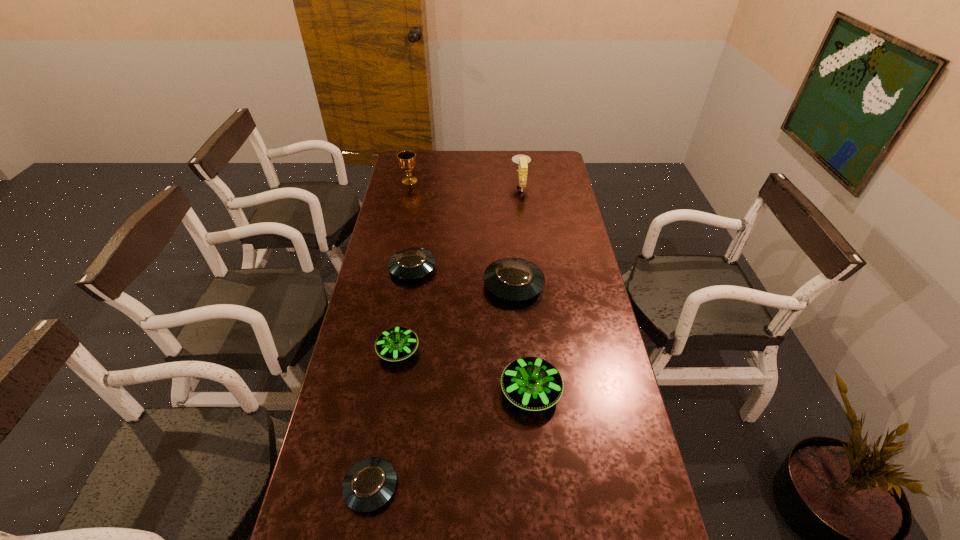
The image size is (960, 540). Identify the location of free spot located on the front-facing side of the yellow sponge. click(444, 186).

Where is `vacant area situated 0.350m on the front of the gold chalice`? vacant area situated 0.350m on the front of the gold chalice is located at coordinates (398, 231).

Find the location of a particular element. vacant space located on the right of the bigger green saucer is located at coordinates (605, 391).

Locate an element on the screen. The width and height of the screenshot is (960, 540). free spot located on the left of the biggest gray saucer is located at coordinates (380, 285).

Where is `vacant space located on the back of the left green saucer`? vacant space located on the back of the left green saucer is located at coordinates (403, 318).

This screenshot has height=540, width=960. Find the location of `free point located 0.130m on the front of the second smallest gray saucer`. free point located 0.130m on the front of the second smallest gray saucer is located at coordinates (406, 310).

This screenshot has height=540, width=960. Find the location of `vacant space located on the right of the nearest saucer`. vacant space located on the right of the nearest saucer is located at coordinates (441, 487).

The width and height of the screenshot is (960, 540). I want to click on object at the far edge, so click(522, 160).

Image resolution: width=960 pixels, height=540 pixels. I want to click on chalice that is positioned at the left edge, so click(407, 162).

This screenshot has width=960, height=540. What are the coordinates of `free space at the far edge` in the screenshot? It's located at (500, 167).